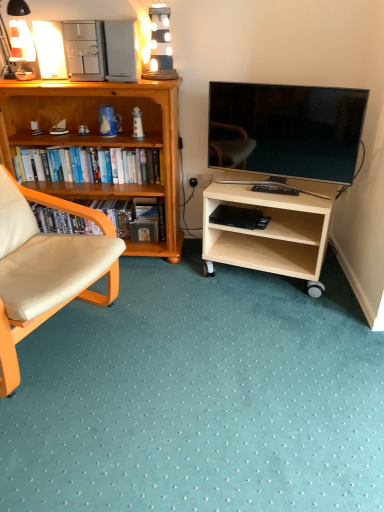
The width and height of the screenshot is (384, 512). What do you see at coordinates (270, 230) in the screenshot?
I see `light wood/finished wood tv stand at lower right, the second desk viewed from the left` at bounding box center [270, 230].

What do you see at coordinates (45, 269) in the screenshot?
I see `beige leather chair at left` at bounding box center [45, 269].

Describe the element at coordinates (100, 139) in the screenshot. I see `wooden bookshelf at left, which appears as the first desk when viewed from the left` at that location.

What do you see at coordinates (286, 129) in the screenshot? The height and width of the screenshot is (512, 384). I see `matte black tv at right` at bounding box center [286, 129].

Locate an element on the screen. The image size is (384, 512). light wood/finished wood tv stand at lower right, which ranks as the first desk in right-to-left order is located at coordinates (270, 230).

Which object is thinner, wooden bookshelf at left, which appears as the first desk when viewed from the left, or matte white lamp at upper left?

With smaller width is matte white lamp at upper left.

Is wooden bookshelf at left, which appears as the first desk when viewed from the left, at the left side of matte white lamp at upper left?

Incorrect, wooden bookshelf at left, which appears as the first desk when viewed from the left, is not on the left side of matte white lamp at upper left.

Can we say wooden bookshelf at left, positioned as the 2th desk in right-to-left order, lies outside matte white lamp at upper left?

That's correct, wooden bookshelf at left, positioned as the 2th desk in right-to-left order, is outside of matte white lamp at upper left.

From a real-world perspective, who is located lower, wooden bookshelf at left, which appears as the first desk when viewed from the left, or matte white lamp at upper left?

wooden bookshelf at left, which appears as the first desk when viewed from the left, is physically lower.

In terms of width, does beige leather chair at left look wider or thinner when compared to matte black tv at right?

Considering their sizes, beige leather chair at left looks broader than matte black tv at right.

In the image, is beige leather chair at left positioned in front of or behind matte black tv at right?

Clearly, beige leather chair at left is in front of matte black tv at right.

Which object is positioned more to the left, beige leather chair at left or matte black tv at right?

From the viewer's perspective, beige leather chair at left appears more on the left side.

Is beige leather chair at left inside the boundaries of matte black tv at right, or outside?

beige leather chair at left cannot be found inside matte black tv at right.

In the scene shown: Which point is more forward, (x=137, y=173) or (x=12, y=4)?

The point (x=12, y=4) is closer.

Identify the location of lamp above the hardcover books at left, which ranks as the 2th book in bottom-to-top order (from a real-world perspective). (21, 41).

Is hardcover books at left, the first book viewed from the top, positioned with its back to matte white lamp at upper left?

No.

Who is taller, hardcover books at left, the first book viewed from the top, or matte white lamp at upper left?

matte white lamp at upper left.

Is beige leather chair at left a part of matte white lamp at upper left?

No, beige leather chair at left is not inside matte white lamp at upper left.

Which object is positioned more to the left, matte white lamp at upper left or beige leather chair at left?

Positioned to the left is matte white lamp at upper left.

Is wooden bookshelf at left, positioned as the 2th desk in right-to-left order, located outside beige leather chair at left?

Yes.

Locate an element on the screen. This screenshot has width=384, height=512. chair in front of the wooden bookshelf at left, which appears as the first desk when viewed from the left is located at coordinates (45, 269).

Which is in front, wooden bookshelf at left, which appears as the first desk when viewed from the left, or beige leather chair at left?

beige leather chair at left is closer to the camera.

Does wooden bookshelf at left, positioned as the 2th desk in right-to-left order, touch beige leather chair at left?

No, wooden bookshelf at left, positioned as the 2th desk in right-to-left order, is not making contact with beige leather chair at left.

From the image's perspective, is wooden bookshelf at left, which appears as the first desk when viewed from the left, over light wood/finished wood tv stand at lower right, the second desk viewed from the left?

Yes, from the image's perspective, wooden bookshelf at left, which appears as the first desk when viewed from the left, is on top of light wood/finished wood tv stand at lower right, the second desk viewed from the left.

Locate an element on the screen. desk behind the light wood/finished wood tv stand at lower right, the second desk viewed from the left is located at coordinates (100, 139).

From a real-world perspective, relative to light wood/finished wood tv stand at lower right, which ranks as the first desk in right-to-left order, is wooden bookshelf at left, which appears as the first desk when viewed from the left, vertically above or below?

In terms of real-world spatial position, wooden bookshelf at left, which appears as the first desk when viewed from the left, is above light wood/finished wood tv stand at lower right, which ranks as the first desk in right-to-left order.

Is black matte bookshelf at left, the second book in the top-to-bottom sequence, facing towards matte black tv at right?

No, black matte bookshelf at left, the second book in the top-to-bottom sequence, is not turned towards matte black tv at right.

From the image's perspective, is black matte bookshelf at left, the second book in the top-to-bottom sequence, located above or below matte black tv at right?

Clearly, from the image's perspective, black matte bookshelf at left, the second book in the top-to-bottom sequence, is below matte black tv at right.

Considering the positions of point (66, 233) and point (343, 124), is point (66, 233) closer or farther from the camera than point (343, 124)?

Point (66, 233) is positioned farther from the camera compared to point (343, 124).

Image resolution: width=384 pixels, height=512 pixels. Find the location of `lamp located on the left of wooden bookshelf at left, which appears as the first desk when viewed from the left`. lamp located on the left of wooden bookshelf at left, which appears as the first desk when viewed from the left is located at coordinates (21, 41).

Locate an element on the screen. television that is behind the beige leather chair at left is located at coordinates (286, 129).

From the image, which object appears to be farther from beige leather chair at left, black matte bookshelf at left, which is the first book in bottom-to-top order, or hardcover books at left, which ranks as the 2th book in bottom-to-top order?

hardcover books at left, which ranks as the 2th book in bottom-to-top order, lies further to beige leather chair at left than the other object.

From the picture: Which object lies nearer to the anchor point light wood/finished wood tv stand at lower right, the second desk viewed from the left, matte black tv at right or black matte bookshelf at left, which is the first book in bottom-to-top order?

matte black tv at right is positioned closer to the anchor light wood/finished wood tv stand at lower right, the second desk viewed from the left.

Considering their positions, is light wood/finished wood tv stand at lower right, the second desk viewed from the left, positioned closer to beige leather chair at left than matte black tv at right?

light wood/finished wood tv stand at lower right, the second desk viewed from the left, is closer to beige leather chair at left.

From the image, which object appears to be nearer to matte black tv at right, matte white lamp at upper left or black matte bookshelf at left, which is the first book in bottom-to-top order?

The object closer to matte black tv at right is black matte bookshelf at left, which is the first book in bottom-to-top order.

Looking at the image, which one is located further to wooden bookshelf at left, which appears as the first desk when viewed from the left, matte white lamp at upper left or black matte bookshelf at left, which is the first book in bottom-to-top order?

matte white lamp at upper left is further to wooden bookshelf at left, which appears as the first desk when viewed from the left.

In the scene shown: From the image, which object appears to be farther from matte black tv at right, beige leather chair at left or matte white lamp at upper left?

matte white lamp at upper left is further to matte black tv at right.

Considering their positions, is matte black tv at right positioned closer to hardcover books at left, the first book viewed from the top, than matte white lamp at upper left?

matte white lamp at upper left lies closer to hardcover books at left, the first book viewed from the top, than the other object.

Based on their spatial positions, is matte black tv at right or hardcover books at left, the first book viewed from the top, further from wooden bookshelf at left, which appears as the first desk when viewed from the left?

Based on the image, matte black tv at right appears to be further to wooden bookshelf at left, which appears as the first desk when viewed from the left.

The image size is (384, 512). Identify the location of chair located between matte white lamp at upper left and matte black tv at right in the left-right direction. (45, 269).

Where is `book between wooden bookshelf at left, positioned as the 2th desk in right-to-left order, and light wood/finished wood tv stand at lower right, which ranks as the first desk in right-to-left order`? The height and width of the screenshot is (512, 384). book between wooden bookshelf at left, positioned as the 2th desk in right-to-left order, and light wood/finished wood tv stand at lower right, which ranks as the first desk in right-to-left order is located at coordinates (62, 221).

Find the location of `television between hardcover books at left, which ranks as the 2th book in bottom-to-top order, and light wood/finished wood tv stand at lower right, which ranks as the first desk in right-to-left order, from left to right`. television between hardcover books at left, which ranks as the 2th book in bottom-to-top order, and light wood/finished wood tv stand at lower right, which ranks as the first desk in right-to-left order, from left to right is located at coordinates (286, 129).

Where is `lamp between beige leather chair at left and wooden bookshelf at left, positioned as the 2th desk in right-to-left order, from front to back`? The height and width of the screenshot is (512, 384). lamp between beige leather chair at left and wooden bookshelf at left, positioned as the 2th desk in right-to-left order, from front to back is located at coordinates (21, 41).